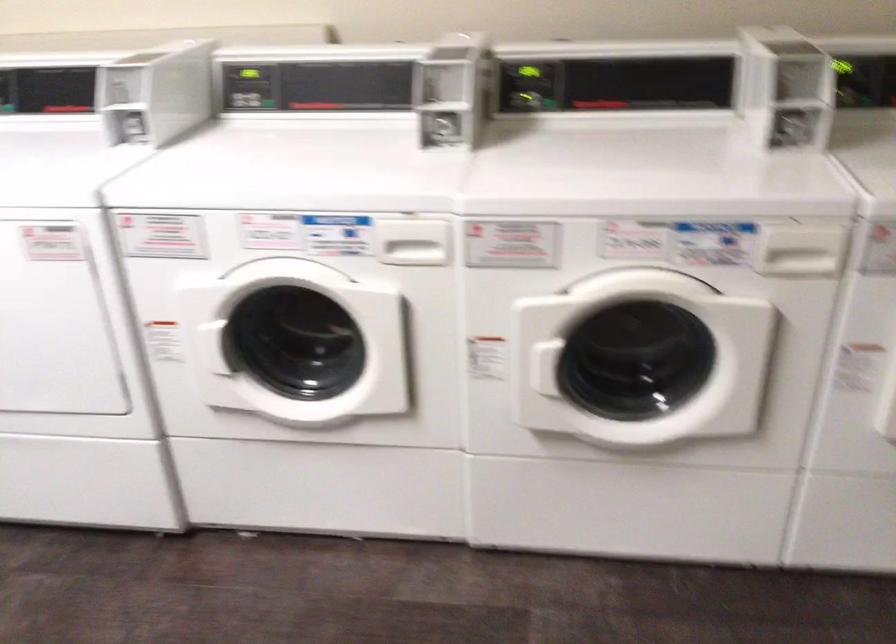
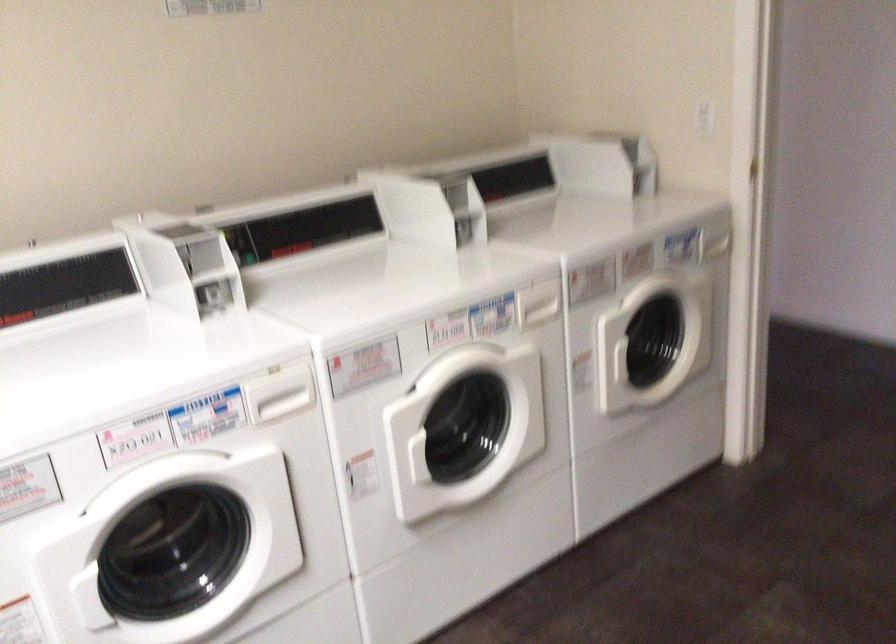
Where in the second image is the point corresponding to pixel 416 240 from the first image?

(279, 393)